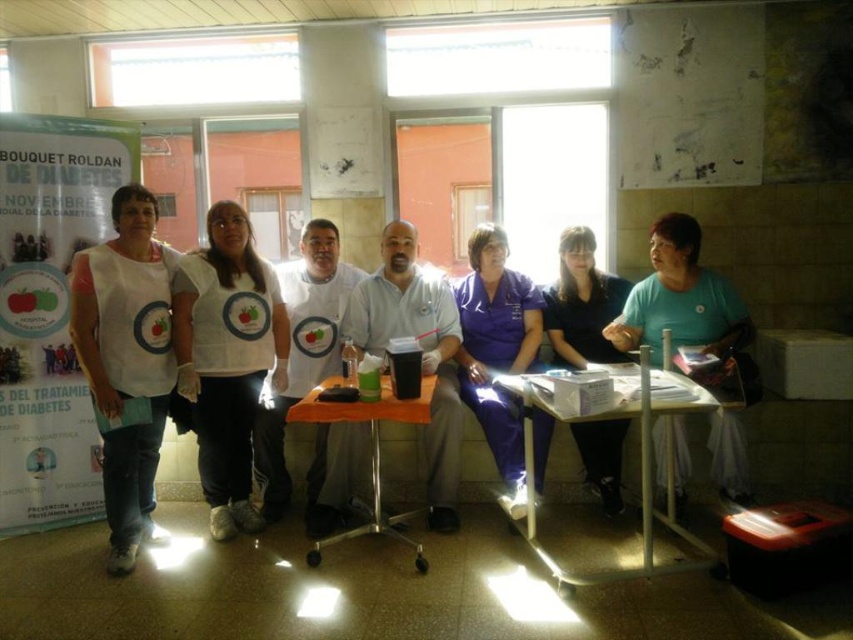
Question: Which of the following is the farthest from the observer?

Choices:
 (A) (440, 442)
 (B) (677, 387)

Answer: (A)

Question: Is white cotton shirt at center closer to the viewer compared to matte plastic table at center?

Choices:
 (A) yes
 (B) no

Answer: (B)

Question: Does white smooth shirt at center appear over matte plastic table at center?

Choices:
 (A) yes
 (B) no

Answer: (A)

Question: Considering the real-world distances, which object is closest to the white plastic table at lower center?

Choices:
 (A) white paper poster at left
 (B) white fabric vest at left
 (C) matte plastic table at center
 (D) white cotton shirt at center

Answer: (C)

Question: Among these points, which one is farthest from the camera?

Choices:
 (A) (404, 236)
 (B) (294, 284)
 (C) (610, 275)

Answer: (C)

Question: Does white smooth shirt at center appear on the left side of matte plastic table at center?

Choices:
 (A) yes
 (B) no

Answer: (B)